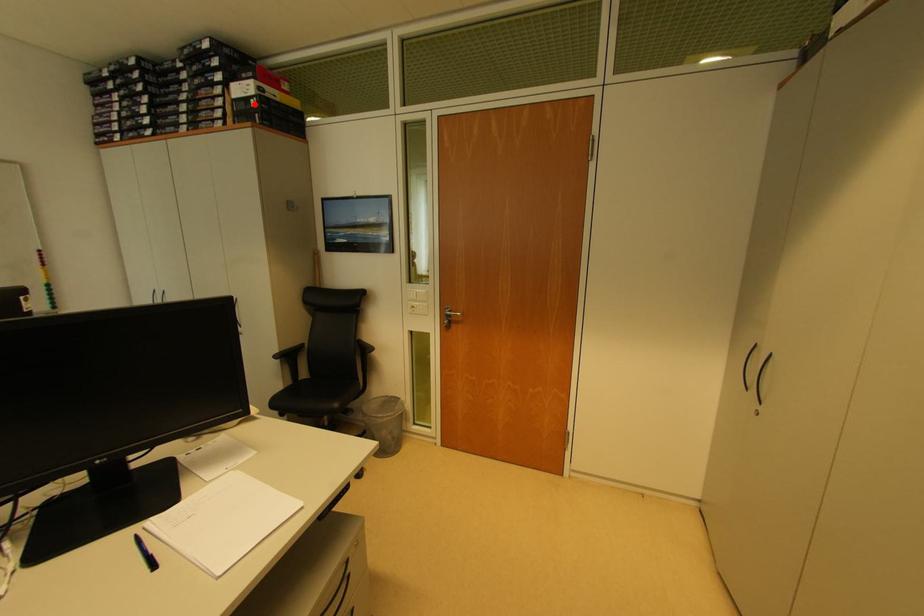
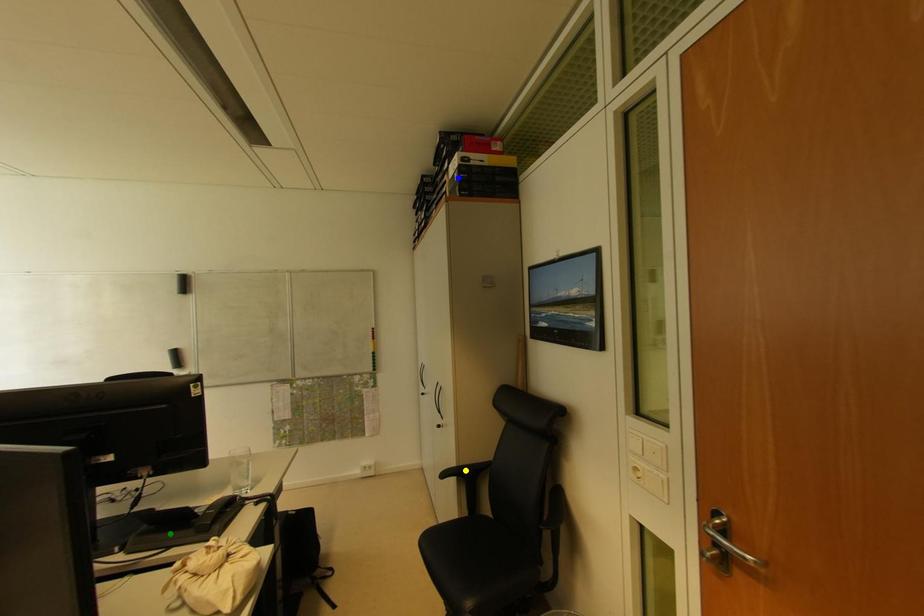
Question: I am providing you with two images of the same scene from different viewpoints. A red point is marked on the first image. You are given multiple points on the second image. Which point in image 2 is actually the same real-world point as the red point in image 1?

Choices:
 (A) yellow point
 (B) blue point
 (C) green point

Answer: (B)